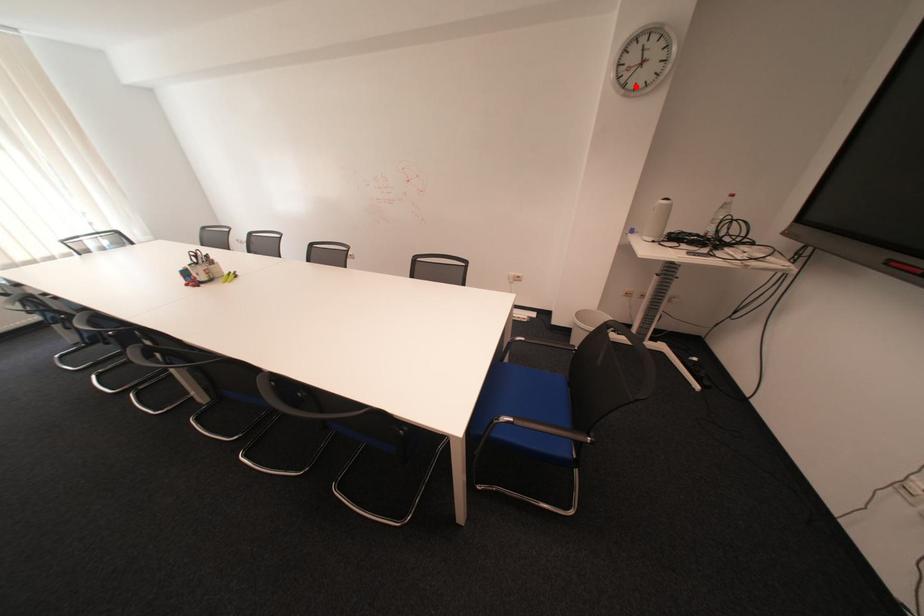
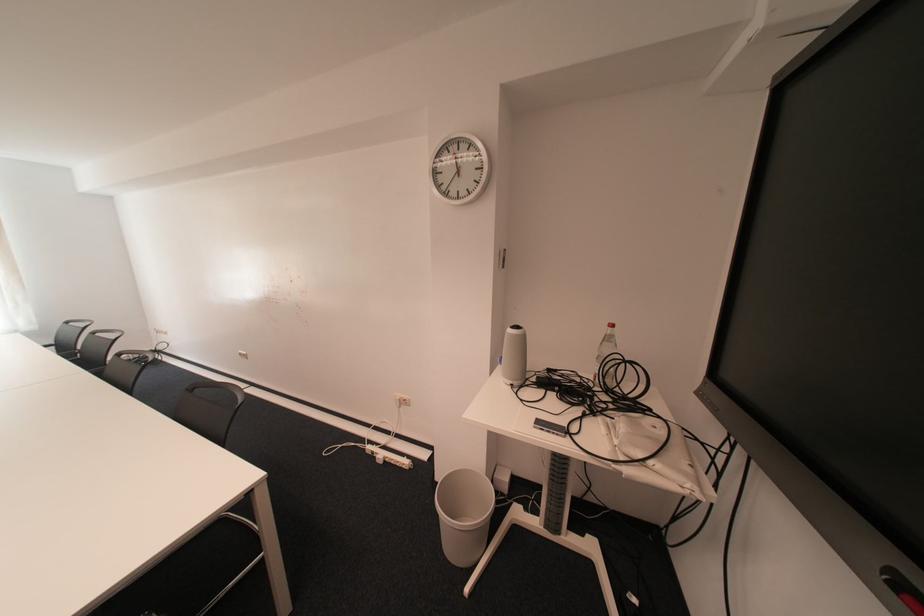
Where in the second image is the point corresponding to the highlighted location from the first image?

(457, 195)